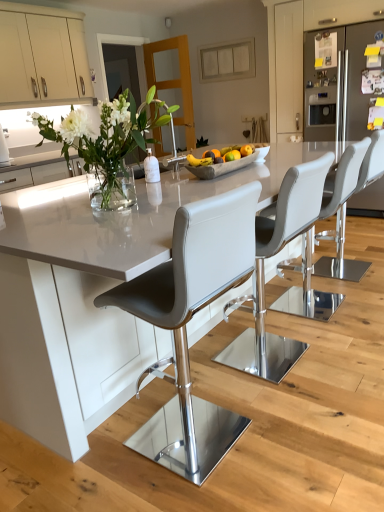
Question: Considering the positions of point (193, 164) and point (64, 333), is point (193, 164) closer or farther from the camera than point (64, 333)?

Choices:
 (A) closer
 (B) farther

Answer: (B)

Question: Is yellow matte banana at center in front of or behind white glossy table at center in the image?

Choices:
 (A) behind
 (B) front

Answer: (A)

Question: Estimate the real-world distances between objects in this image. Which object is closer to the matte gray bar stool at center, acting as the first chair starting from the front?

Choices:
 (A) white glossy table at center
 (B) satin white cabinet at right, the 1th cabinetry viewed from the right
 (C) gray leather stool at center, the 2th chair from the back
 (D) yellow matte banana at center
 (E) white leather bar stool at center, which is the second chair in front-to-back order

Answer: (E)

Question: Which object is positioned farthest from the white glass vase at upper left?

Choices:
 (A) matte gray bar stool at center, which ranks as the fourth chair in front-to-back order
 (B) beige matte cabinet at upper left, which ranks as the first cabinetry in left-to-right order
 (C) gray leather stool at center, the 2th chair from the back
 (D) yellow matte banana at center
 (E) white leather bar stool at center, which is the second chair in front-to-back order

Answer: (B)